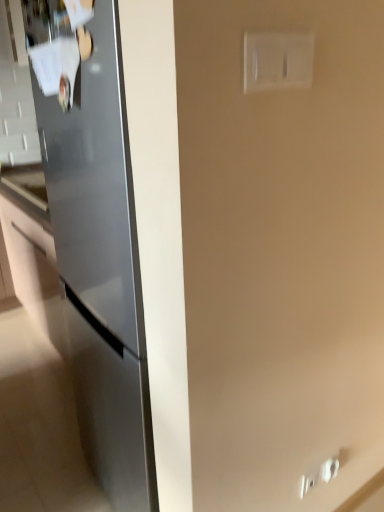
You are a GUI agent. You are given a task and a screenshot of the screen. Output one action in this format:
    pyautogui.click(x=<x>, y=<y>)
    Task: Click on the vacant space situated on the left part of sleek metallic refrigerator at left
    
    Given the screenshot: What is the action you would take?
    pyautogui.click(x=49, y=462)